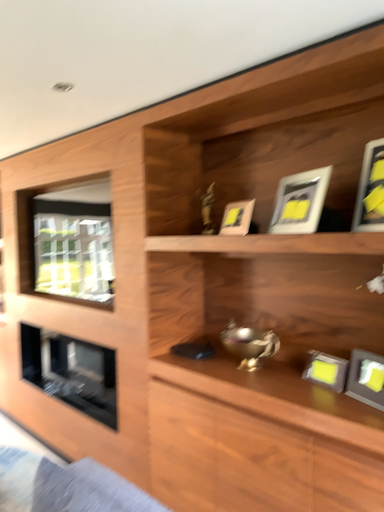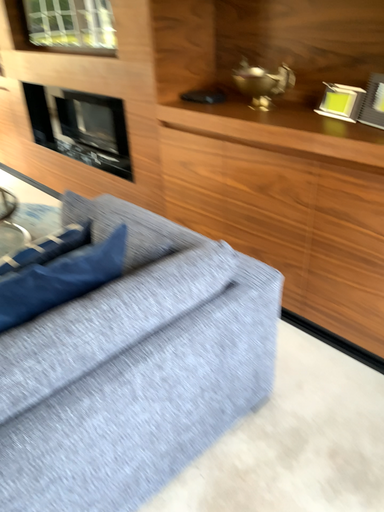
Question: How did the camera likely rotate when shooting the video?

Choices:
 (A) rotated upward
 (B) rotated downward

Answer: (B)